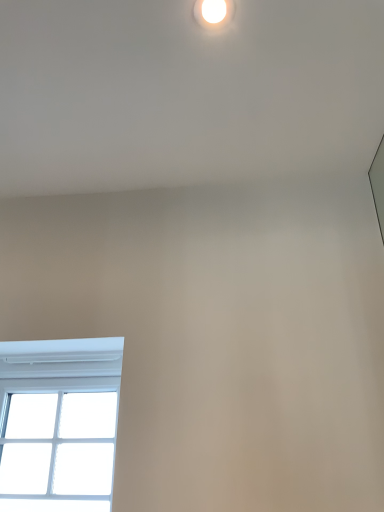
Question: Is white glossy droplight at upper center outside of white plastic window at lower left?

Choices:
 (A) no
 (B) yes

Answer: (B)

Question: Considering the relative sizes of white glossy droplight at upper center and white plastic window at lower left in the image provided, is white glossy droplight at upper center smaller than white plastic window at lower left?

Choices:
 (A) yes
 (B) no

Answer: (A)

Question: From the image's perspective, is white glossy droplight at upper center under white plastic window at lower left?

Choices:
 (A) yes
 (B) no

Answer: (B)

Question: Would you consider white glossy droplight at upper center to be distant from white plastic window at lower left?

Choices:
 (A) no
 (B) yes

Answer: (B)

Question: Can you confirm if white glossy droplight at upper center is thinner than white plastic window at lower left?

Choices:
 (A) yes
 (B) no

Answer: (A)

Question: Is the position of white glossy droplight at upper center less distant than that of white plastic window at lower left?

Choices:
 (A) yes
 (B) no

Answer: (A)

Question: Is white plastic window at lower left positioned with its back to white glossy droplight at upper center?

Choices:
 (A) no
 (B) yes

Answer: (A)

Question: Can you confirm if white plastic window at lower left is taller than white glossy droplight at upper center?

Choices:
 (A) yes
 (B) no

Answer: (A)

Question: From a real-world perspective, is white plastic window at lower left below white glossy droplight at upper center?

Choices:
 (A) yes
 (B) no

Answer: (A)

Question: Can you see white plastic window at lower left touching white glossy droplight at upper center?

Choices:
 (A) yes
 (B) no

Answer: (B)

Question: Would you say white plastic window at lower left contains white glossy droplight at upper center?

Choices:
 (A) yes
 (B) no

Answer: (B)

Question: Does white plastic window at lower left lie behind white glossy droplight at upper center?

Choices:
 (A) yes
 (B) no

Answer: (A)

Question: Considering their positions, is white glossy droplight at upper center located in front of or behind white plastic window at lower left?

Choices:
 (A) front
 (B) behind

Answer: (A)